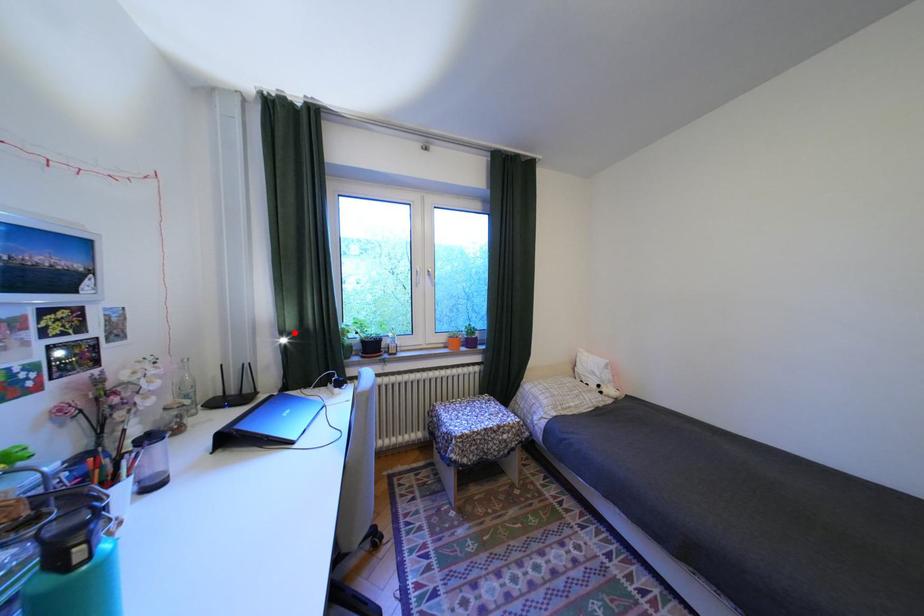
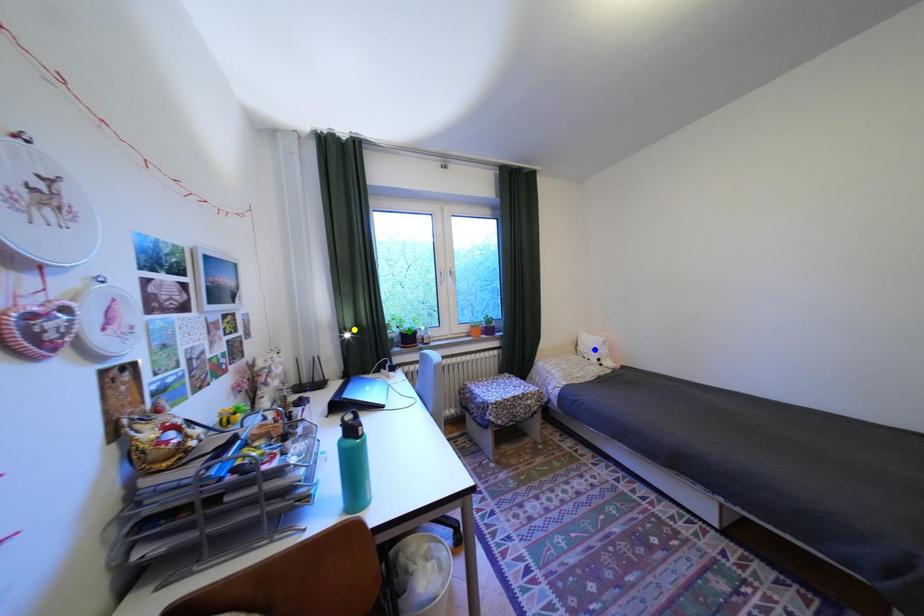
Question: I am providing you with two images of the same scene from different viewpoints. A red point is marked on the first image. You are given multiple points on the second image. Which mark in image 2 goes with the point in image 1?

Choices:
 (A) yellow point
 (B) green point
 (C) blue point

Answer: (A)